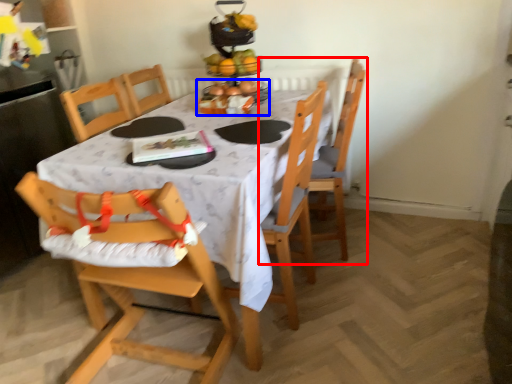
Question: Which of the following is the closest to the observer, chair (highlighted by a red box) or tableware (highlighted by a blue box)?

Choices:
 (A) chair
 (B) tableware

Answer: (A)